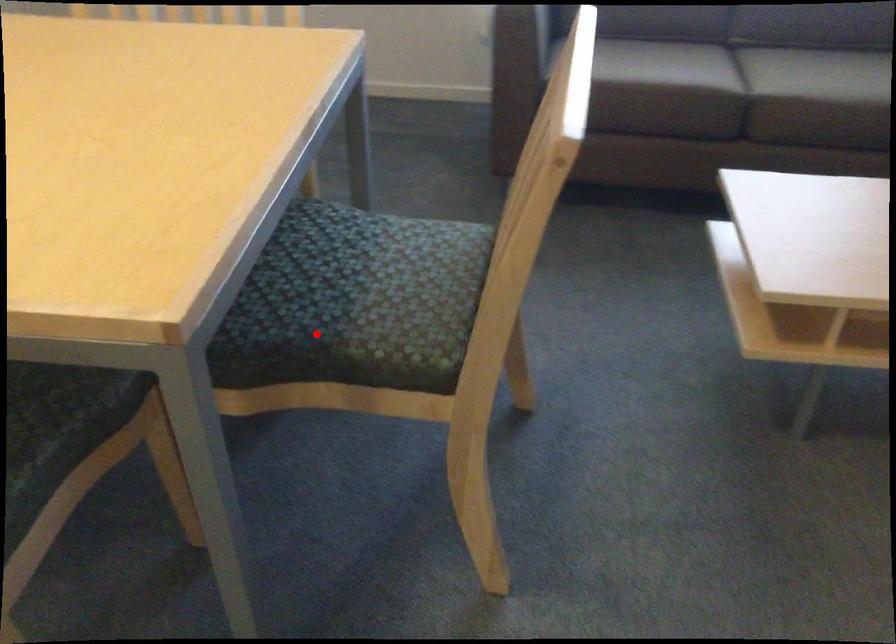
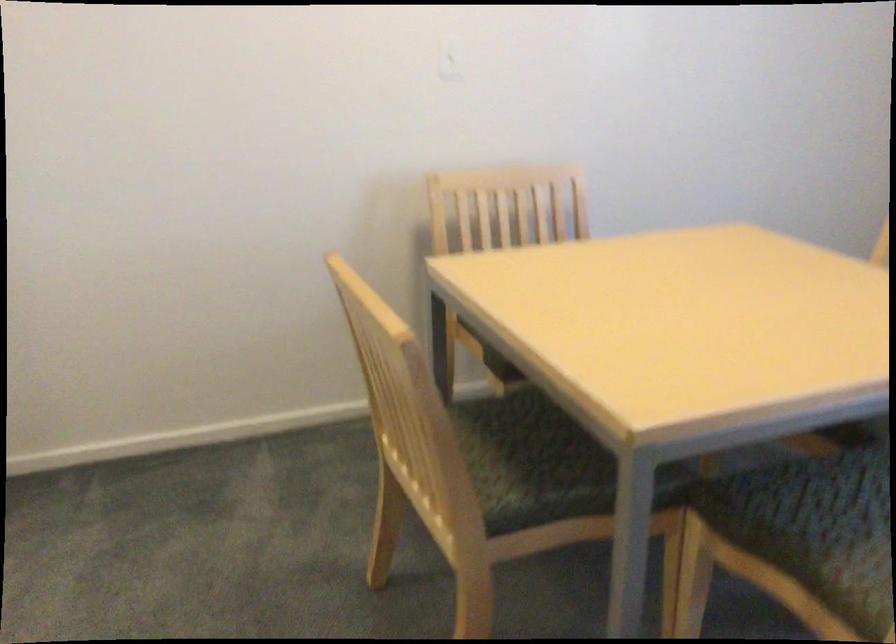
Question: A red point is marked in image1. In image2, is the corresponding 3D point closer to the camera or farther? Reply with the corresponding letter.

Choices:
 (A) The corresponding 3D point is closer.
 (B) The corresponding 3D point is farther.

Answer: (B)